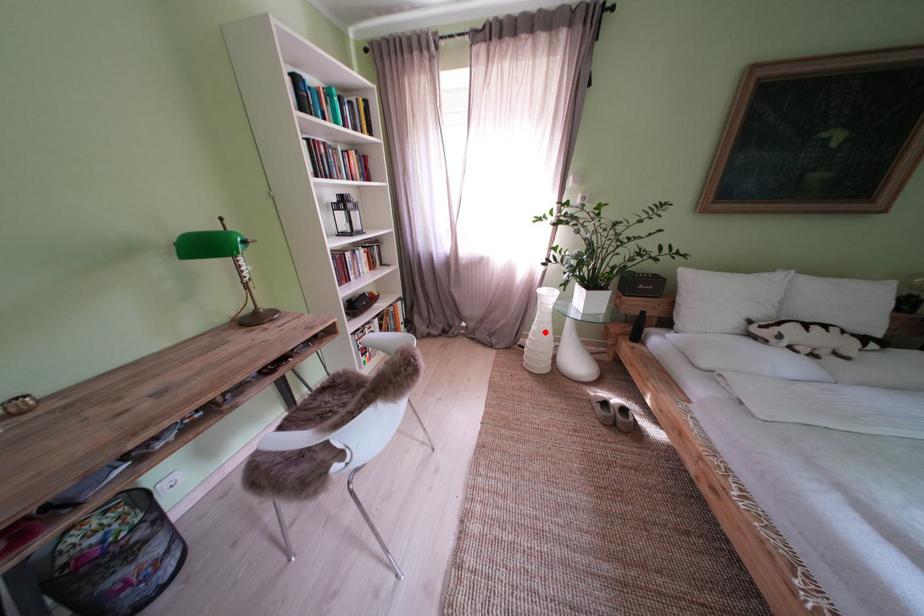
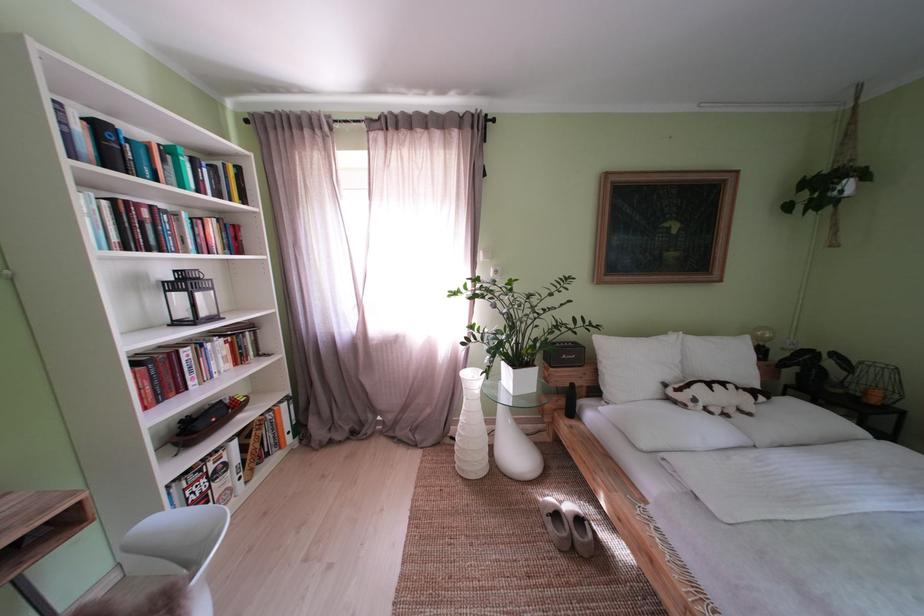
The point at the highlighted location is marked in the first image. Where is the corresponding point in the second image?

(472, 424)